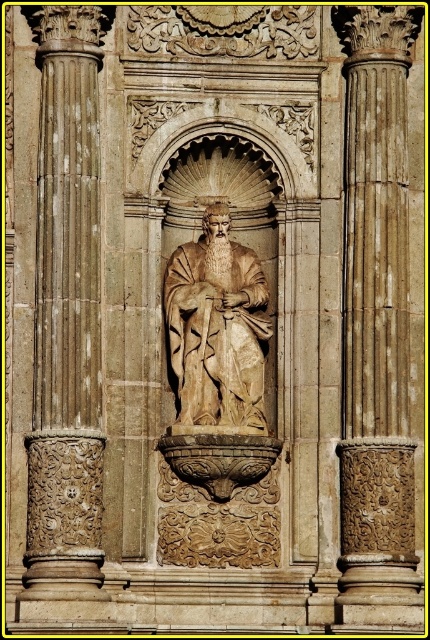
Can you confirm if beige stone column at center is positioned to the right of beige stone statue at center?

Indeed, beige stone column at center is positioned on the right side of beige stone statue at center.

Identify the location of beige stone column at center. (377, 324).

Identify the location of beige stone column at center. This screenshot has height=640, width=430. (377, 324).

This screenshot has width=430, height=640. What are the coordinates of `beige stone column at center` in the screenshot? It's located at (377, 324).

Between point (70, 273) and point (248, 376), which one is positioned in front?

Point (70, 273)

Does carved stone column at center have a lesser width compared to beige stone statue at center?

Indeed, carved stone column at center has a lesser width compared to beige stone statue at center.

Locate an element on the screen. The width and height of the screenshot is (430, 640). carved stone column at center is located at coordinates (67, 316).

Is beige stone column at center further to the viewer compared to carved stone column at center?

Yes, it is behind carved stone column at center.

Can you confirm if beige stone column at center is taller than carved stone column at center?

Correct, beige stone column at center is much taller as carved stone column at center.

Locate an element on the screen. This screenshot has width=430, height=640. beige stone column at center is located at coordinates (377, 324).